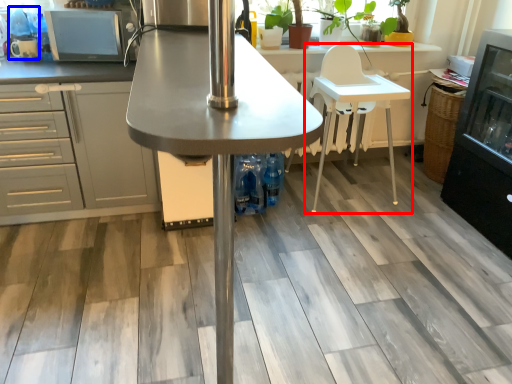
Question: Among these objects, which one is nearest to the camera, chair (highlighted by a red box) or appliance (highlighted by a blue box)?

Choices:
 (A) chair
 (B) appliance

Answer: (A)